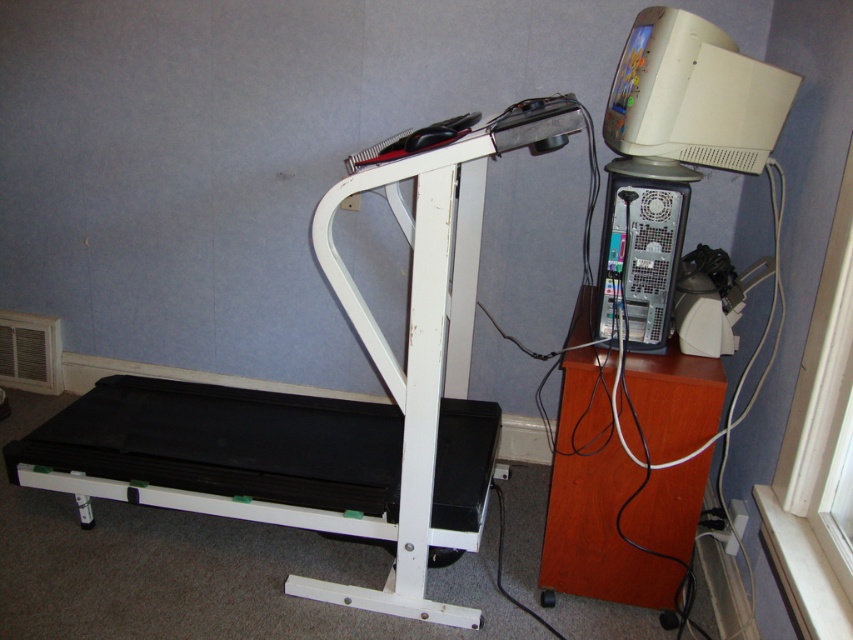
Question: Which of the following is the closest to the observer?

Choices:
 (A) black rubber treadmill at left
 (B) satin silver computer tower at right
 (C) white plastic air conditioner at lower left

Answer: (A)

Question: Among these points, which one is nearest to the camera?

Choices:
 (A) (660, 65)
 (B) (628, 278)

Answer: (A)

Question: Does black rubber treadmill at left appear under beige plastic monitor at upper right?

Choices:
 (A) no
 (B) yes

Answer: (B)

Question: Can you confirm if black rubber treadmill at left is positioned to the right of white plastic air conditioner at lower left?

Choices:
 (A) yes
 (B) no

Answer: (A)

Question: Considering the real-world distances, which object is farthest from the black rubber treadmill at left?

Choices:
 (A) beige plastic monitor at upper right
 (B) satin silver computer tower at right

Answer: (B)

Question: Is black rubber treadmill at left wider than beige plastic monitor at upper right?

Choices:
 (A) no
 (B) yes

Answer: (B)